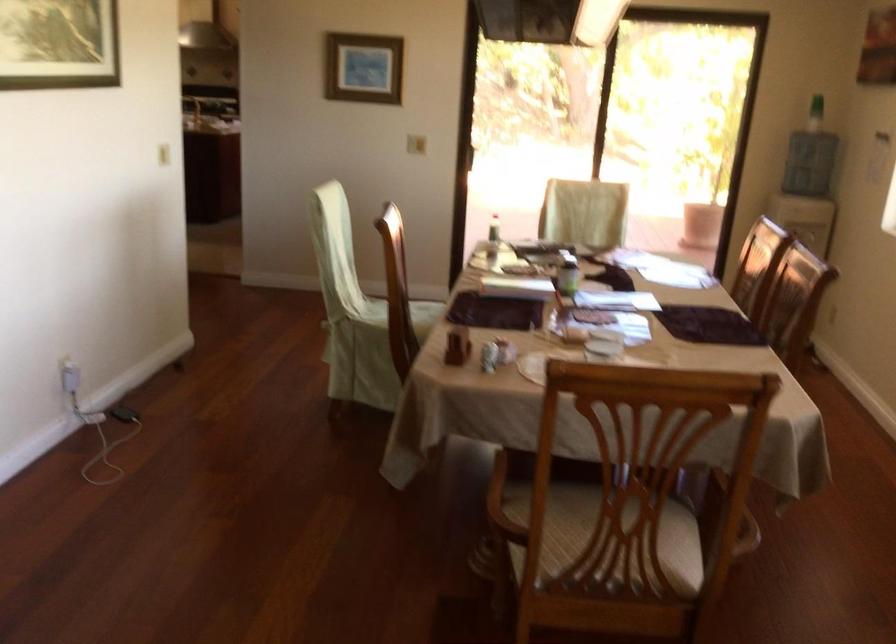
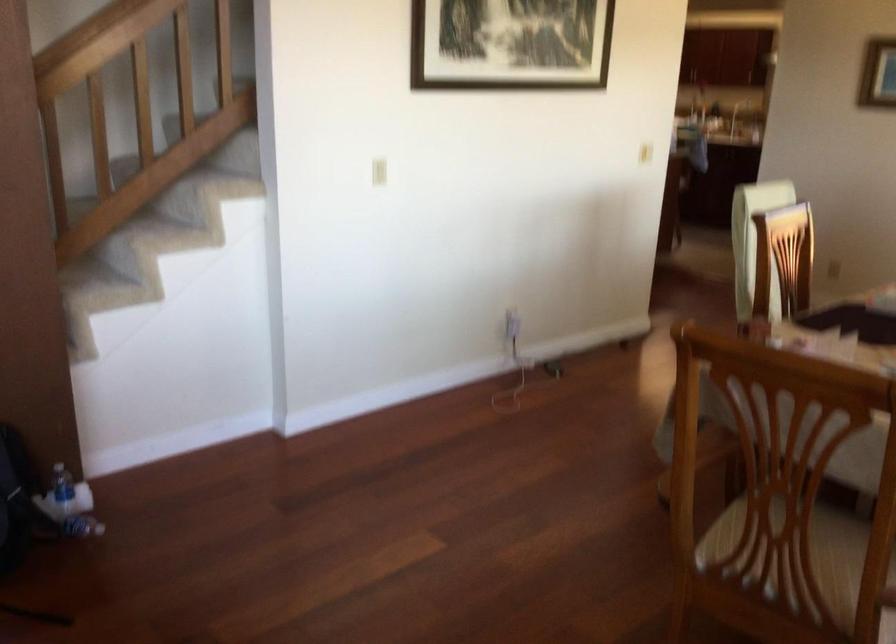
The point at [545,542] is marked in the first image. Where is the corresponding point in the second image?

(736, 532)